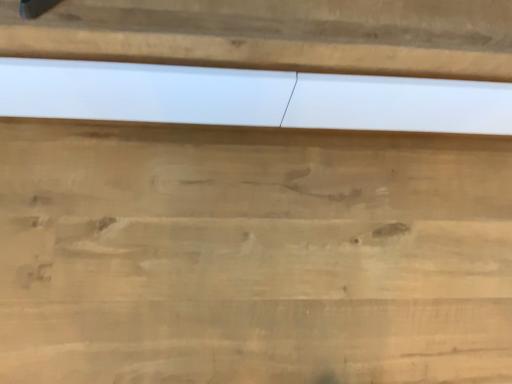
Question: From a real-world perspective, relative to natural wood cutting board at center, is white matte panel at center vertically above or below?

Choices:
 (A) above
 (B) below

Answer: (A)

Question: Looking at the image, does white matte panel at center seem bigger or smaller compared to natural wood cutting board at center?

Choices:
 (A) big
 (B) small

Answer: (A)

Question: Visually, is white matte panel at center positioned to the left or to the right of natural wood cutting board at center?

Choices:
 (A) right
 (B) left

Answer: (A)

Question: Is natural wood cutting board at center wider or thinner than white matte panel at center?

Choices:
 (A) thin
 (B) wide

Answer: (B)

Question: From a real-world perspective, is natural wood cutting board at center positioned above or below white matte panel at center?

Choices:
 (A) above
 (B) below

Answer: (B)

Question: Is point click(x=310, y=150) positioned closer to the camera than point click(x=422, y=23)?

Choices:
 (A) closer
 (B) farther

Answer: (B)

Question: Looking at the image, does natural wood cutting board at center seem bigger or smaller compared to white matte panel at center?

Choices:
 (A) small
 (B) big

Answer: (A)